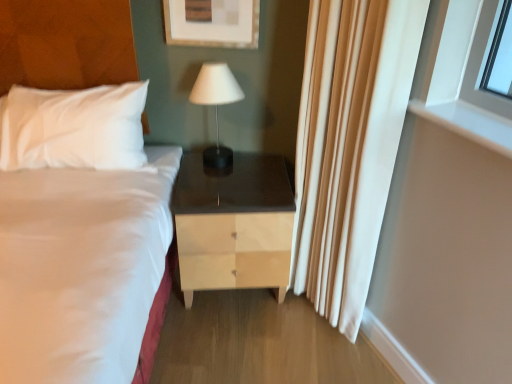
The height and width of the screenshot is (384, 512). I want to click on blank space above light wood/finish nightstand at center (from a real-world perspective), so click(234, 175).